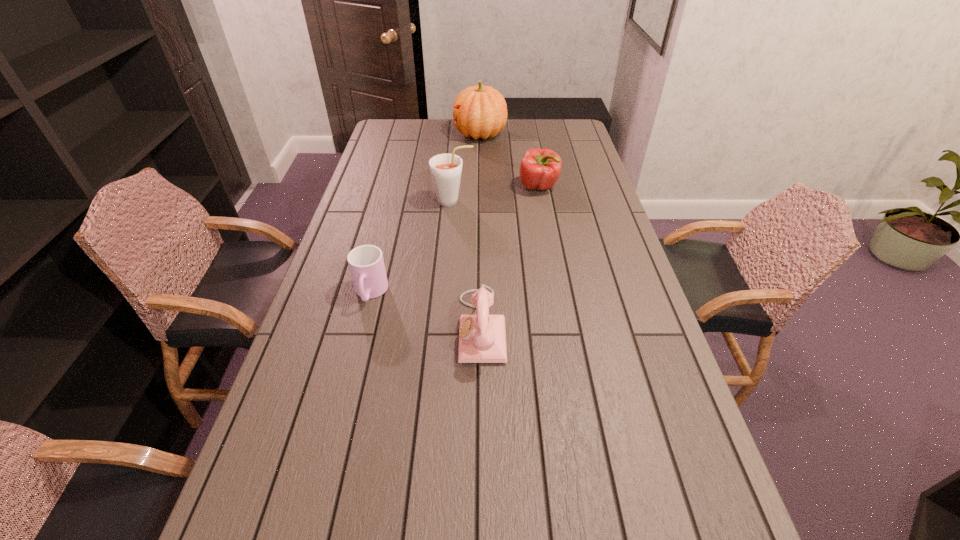
The height and width of the screenshot is (540, 960). Find the location of `pumpkin`. pumpkin is located at coordinates (480, 111).

Image resolution: width=960 pixels, height=540 pixels. What are the coordinates of `the farthest object` in the screenshot? It's located at (480, 111).

Where is `root beer`? Image resolution: width=960 pixels, height=540 pixels. root beer is located at coordinates (446, 169).

Find the location of a particular element. The width and height of the screenshot is (960, 540). the rightmost object is located at coordinates (540, 168).

Locate an element on the screen. This screenshot has height=540, width=960. telephone is located at coordinates (482, 337).

The width and height of the screenshot is (960, 540). In order to click on cup in this screenshot , I will do (366, 263).

Image resolution: width=960 pixels, height=540 pixels. Identify the location of the shortest object. (366, 263).

Identify the location of vacant position located 0.210m on the carved face of the tallest object. This screenshot has height=540, width=960. (407, 134).

Image resolution: width=960 pixels, height=540 pixels. Identify the location of vacant space located on the carved face of the tallest object. (441, 134).

The width and height of the screenshot is (960, 540). What are the coordinates of `vacant region located on the carved face of the tallest object` in the screenshot? It's located at (443, 134).